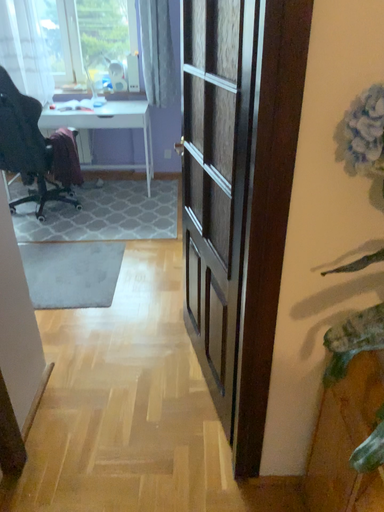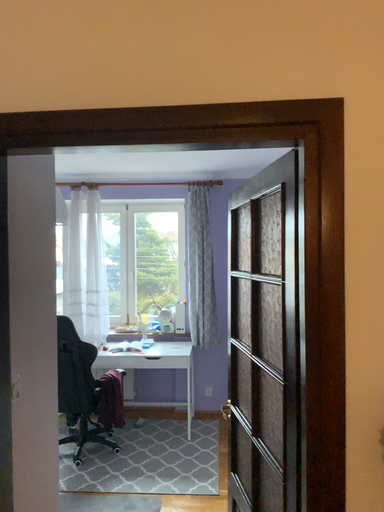
Question: Which way did the camera rotate in the video?

Choices:
 (A) rotated upward
 (B) rotated downward

Answer: (A)